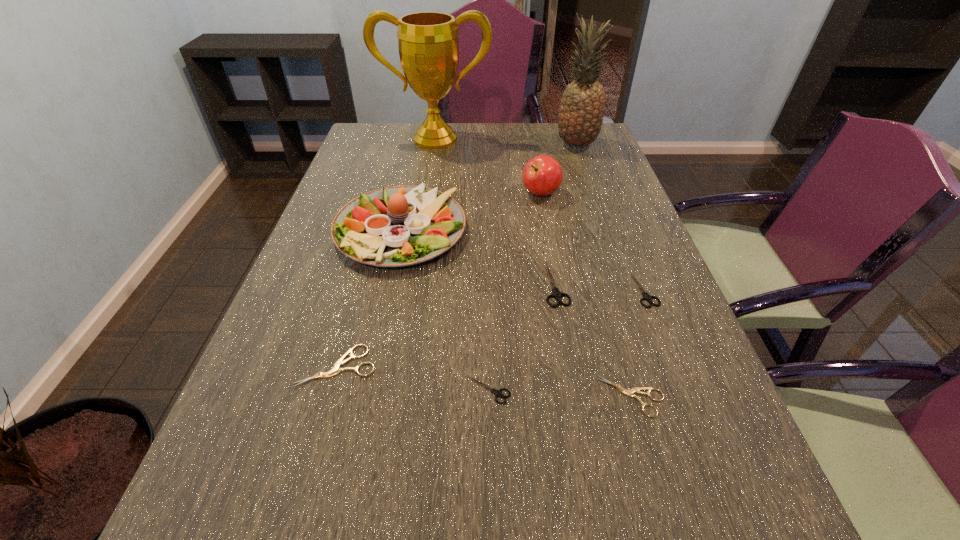
Find the location of a particular element. free space located 0.310m on the right of the leftmost shears is located at coordinates (536, 366).

At what (x,y) coordinates should I click in order to perform the action: click on free location located on the back of the second shears from right to left. Please return your answer as a coordinate pair (x, y). The width and height of the screenshot is (960, 540). Looking at the image, I should click on (609, 314).

Find the location of `free spot located on the left of the second shears from left to right`. free spot located on the left of the second shears from left to right is located at coordinates (250, 390).

Locate an element on the screen. This screenshot has height=540, width=960. award that is positioned at the far edge is located at coordinates (428, 44).

Locate an element on the screen. The height and width of the screenshot is (540, 960). pineapple that is at the far edge is located at coordinates (580, 118).

Where is `award located in the left edge section of the desktop`? This screenshot has width=960, height=540. award located in the left edge section of the desktop is located at coordinates (428, 44).

Identify the location of salad plate situated at the left edge. (397, 226).

This screenshot has width=960, height=540. I want to click on shears situated at the left edge, so click(x=336, y=369).

Identify the location of pineapple present at the right edge. (580, 118).

Find the location of `object positioned at the far left corner`. object positioned at the far left corner is located at coordinates (428, 44).